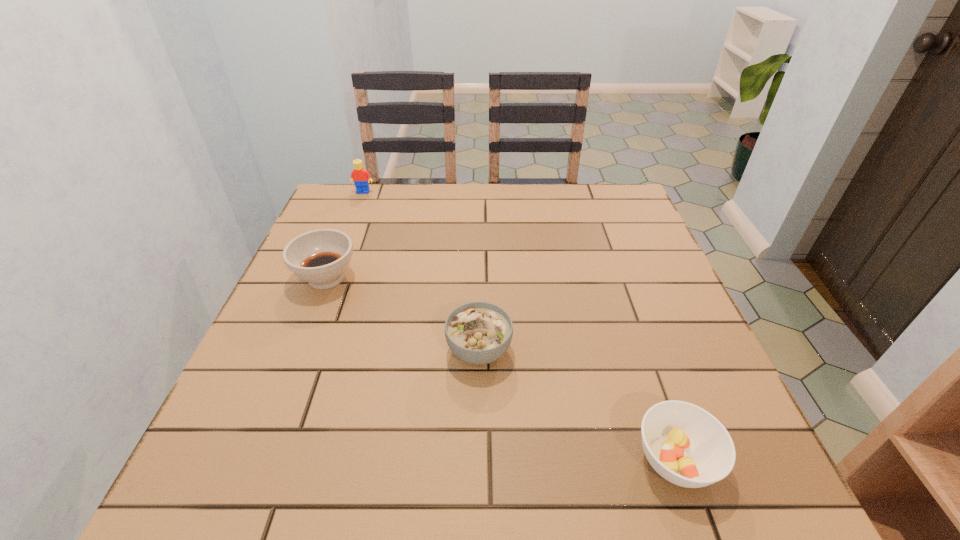
Identify the location of free space located on the back of the second nearest soup bowl. (479, 267).

The height and width of the screenshot is (540, 960). Find the location of `vacant space located on the left of the shortest object`. vacant space located on the left of the shortest object is located at coordinates (531, 460).

Where is `object positioned at the far edge`? This screenshot has height=540, width=960. object positioned at the far edge is located at coordinates (361, 177).

The image size is (960, 540). I want to click on object at the near edge, so click(686, 445).

Where is `Lego positioned at the left edge`? This screenshot has width=960, height=540. Lego positioned at the left edge is located at coordinates (361, 177).

Image resolution: width=960 pixels, height=540 pixels. Find the location of `soup bowl present at the left edge`. soup bowl present at the left edge is located at coordinates 320,257.

Locate an element on the screen. This screenshot has height=540, width=960. object situated at the right edge is located at coordinates (686, 445).

Find the location of a particular element. object at the far left corner is located at coordinates (361, 177).

Find the location of a particular element. object that is at the near right corner is located at coordinates (686, 445).

In the image, there is a desktop. At what (x,y) coordinates should I click in order to perform the action: click on vacant region at the far edge. Please return your answer as a coordinate pair (x, y). Looking at the image, I should click on (565, 214).